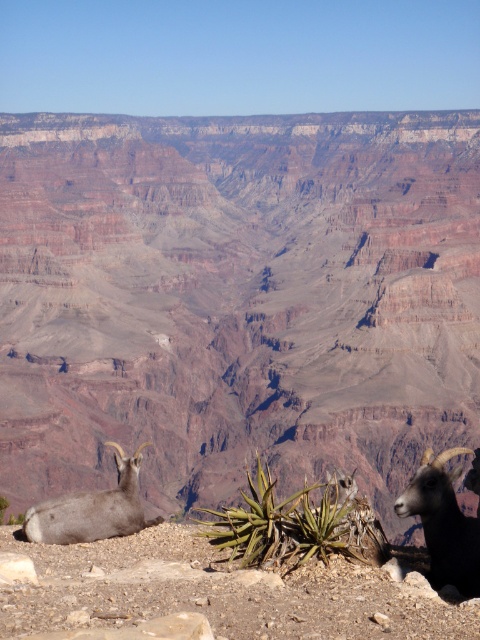
Question: Which point is farther from the camera taking this photo?

Choices:
 (A) (68, 529)
 (B) (444, 508)
 (C) (387, 189)

Answer: (C)

Question: Does gray rocky hillside at lower center lie behind gray woolen goat at lower left?

Choices:
 (A) no
 (B) yes

Answer: (B)

Question: Which object is farther from the camera taking this photo?

Choices:
 (A) gray rocky hillside at lower center
 (B) black woolly goat at lower right

Answer: (A)

Question: Which object is the farthest from the gray rocky hillside at lower center?

Choices:
 (A) black woolly goat at lower right
 (B) gray woolen goat at lower left

Answer: (A)

Question: Does gray rocky hillside at lower center appear over gray woolen goat at lower left?

Choices:
 (A) yes
 (B) no

Answer: (A)

Question: Considering the relative positions of gray rocky hillside at lower center and black woolly goat at lower right in the image provided, where is gray rocky hillside at lower center located with respect to black woolly goat at lower right?

Choices:
 (A) above
 (B) below

Answer: (A)